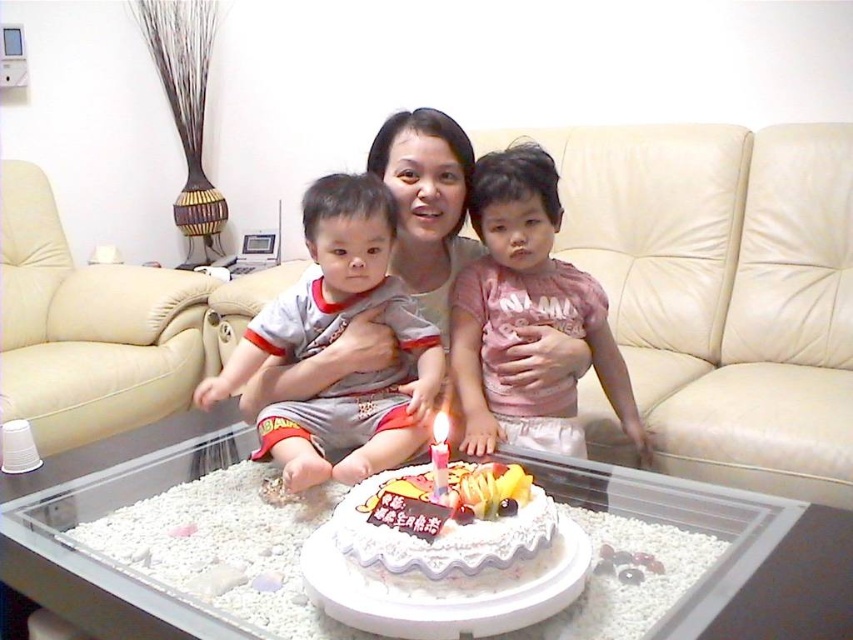
In the scene shown: Can you confirm if white frosted cake at center is smaller than white wax candle at center?

No.

Which is in front, point (515, 547) or point (434, 497)?

Positioned in front is point (515, 547).

Is point (448, 547) positioned after point (432, 440)?

No, (448, 547) is in front of (432, 440).

The width and height of the screenshot is (853, 640). Identify the location of white frosted cake at center. (450, 532).

Can you confirm if pink cotton shirt at center is bigger than white wax candle at center?

Yes.

Is pink cotton shirt at center shorter than white wax candle at center?

Incorrect, pink cotton shirt at center's height does not fall short of white wax candle at center's.

Find the location of a particular element. The image size is (853, 640). pink cotton shirt at center is located at coordinates (527, 312).

Does gray cotton shirt at center have a lesser height compared to white frosted cake at center?

No, gray cotton shirt at center is not shorter than white frosted cake at center.

Which is more to the right, gray cotton shirt at center or white frosted cake at center?

white frosted cake at center is more to the right.

Find the location of a particular element. gray cotton shirt at center is located at coordinates (335, 339).